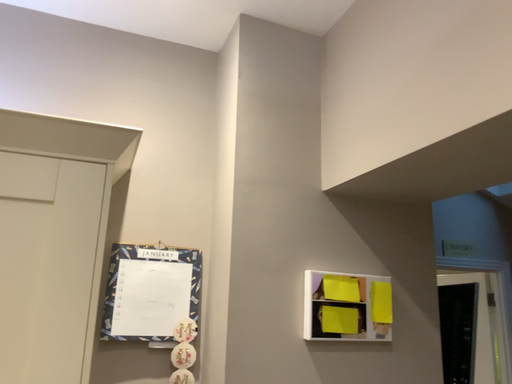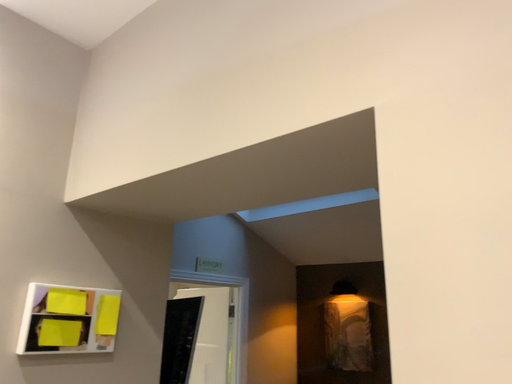
Question: Which way did the camera rotate in the video?

Choices:
 (A) rotated left
 (B) rotated right

Answer: (B)